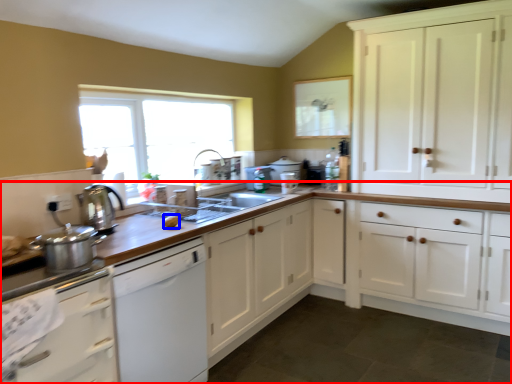
Question: Which object is further to the camera taking this photo, countertop (highlighted by a red box) or food (highlighted by a blue box)?

Choices:
 (A) countertop
 (B) food

Answer: (B)